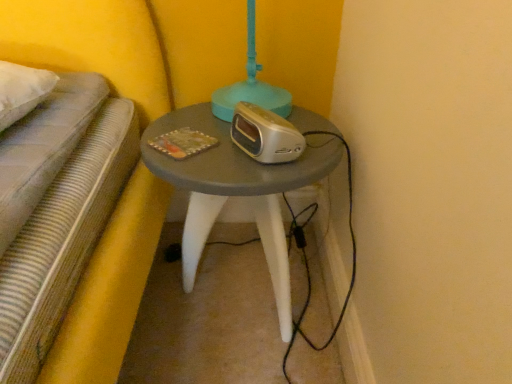
This screenshot has height=384, width=512. I want to click on free space in front of silver metallic alarm clock at center, so click(x=251, y=165).